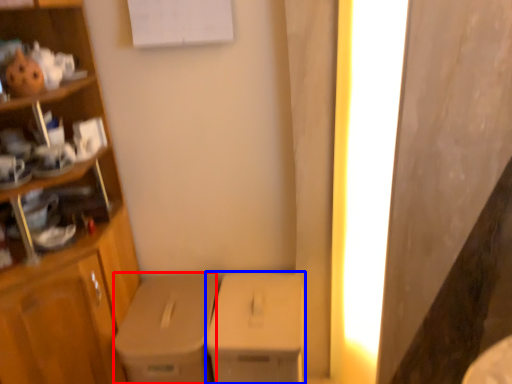
Question: Among these objects, which one is nearest to the camera, cardboard box (highlighted by a red box) or cardboard box (highlighted by a blue box)?

Choices:
 (A) cardboard box
 (B) cardboard box

Answer: (B)